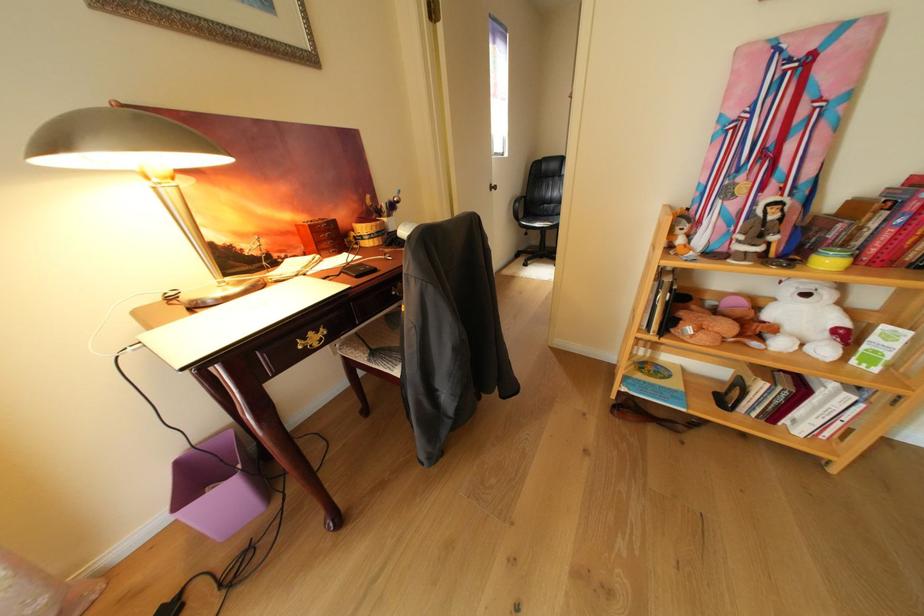
The width and height of the screenshot is (924, 616). Describe the element at coordinates (541, 220) in the screenshot. I see `a black chair sitting surface` at that location.